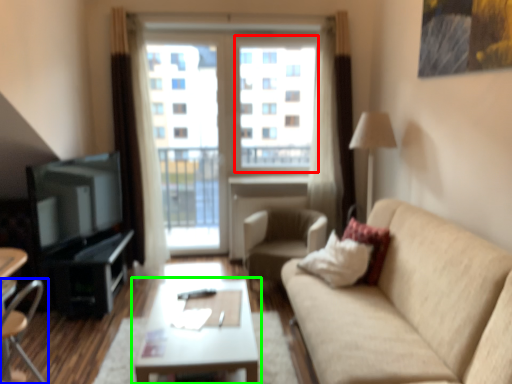
Question: Estimate the real-world distances between objects in this image. Which object is farther from window screen (highlighted by a red box), chair (highlighted by a blue box) or coffee table (highlighted by a green box)?

Choices:
 (A) chair
 (B) coffee table

Answer: (A)